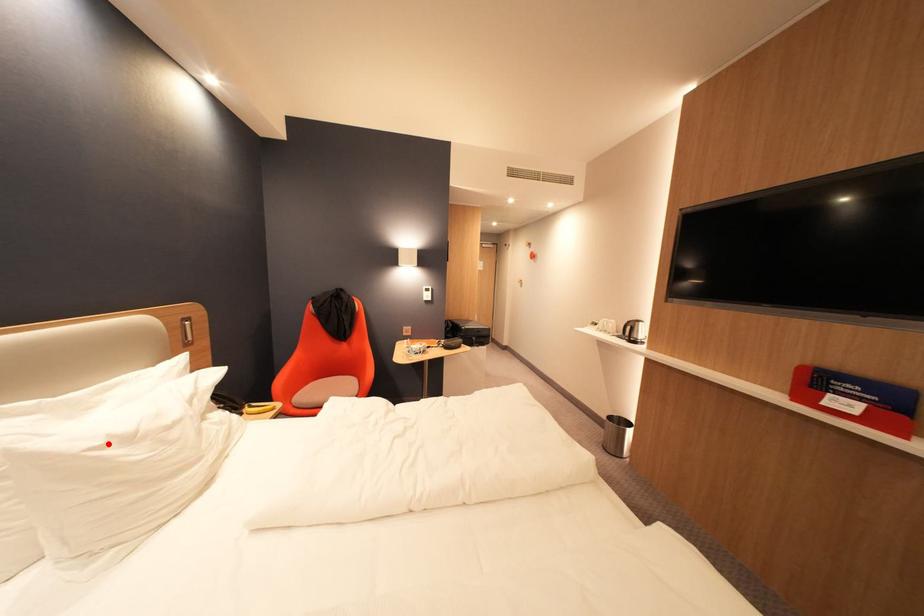
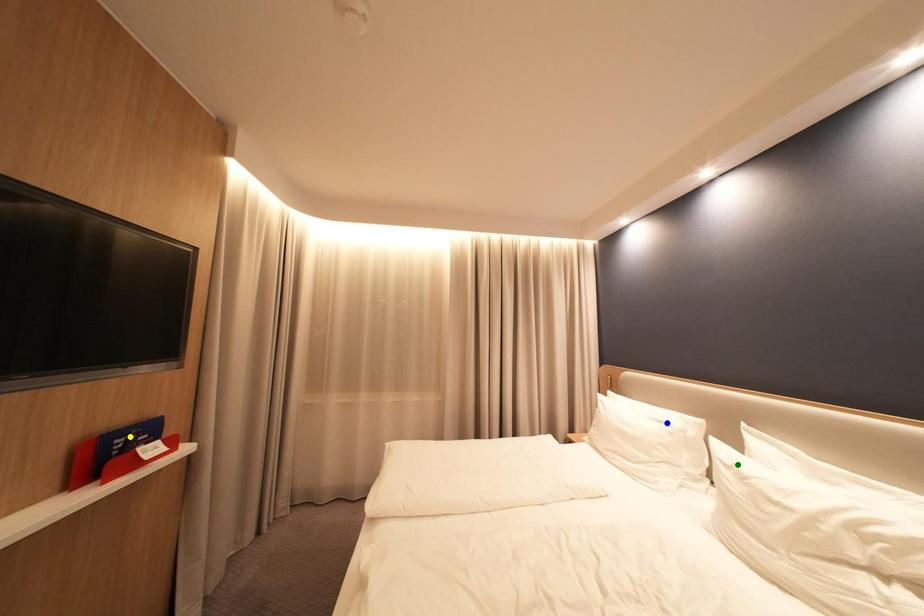
Question: I am providing you with two images of the same scene from different viewpoints. A red point is marked on the first image. You are given multiple points on the second image. In image 2, which mark is for the same physical point as the one in image 1?

Choices:
 (A) yellow point
 (B) blue point
 (C) green point

Answer: (C)